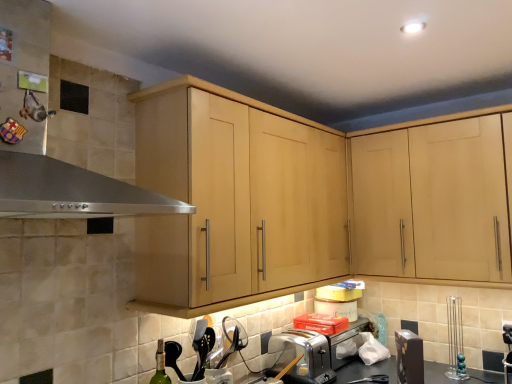
Question: From a real-world perspective, is stainless steel exhaust hood at upper left positioned under green glass bottle at lower left based on gravity?

Choices:
 (A) yes
 (B) no

Answer: (B)

Question: From a real-world perspective, does stainless steel exhaust hood at upper left stand above green glass bottle at lower left?

Choices:
 (A) yes
 (B) no

Answer: (A)

Question: Could you tell me if stainless steel exhaust hood at upper left is facing green glass bottle at lower left?

Choices:
 (A) yes
 (B) no

Answer: (B)

Question: Is stainless steel exhaust hood at upper left at the right side of green glass bottle at lower left?

Choices:
 (A) no
 (B) yes

Answer: (A)

Question: Can you see stainless steel exhaust hood at upper left touching green glass bottle at lower left?

Choices:
 (A) yes
 (B) no

Answer: (B)

Question: From a real-world perspective, relative to green glass bottle at lower left, is light wood cabinet at upper right, which is the 1th cabinetry in right-to-left order, vertically above or below?

Choices:
 (A) above
 (B) below

Answer: (A)

Question: From the image's perspective, is light wood cabinet at upper right, which is the 1th cabinetry in right-to-left order, positioned above or below green glass bottle at lower left?

Choices:
 (A) above
 (B) below

Answer: (A)

Question: Which is correct: light wood cabinet at upper right, which is the 1th cabinetry in right-to-left order, is inside green glass bottle at lower left, or outside of it?

Choices:
 (A) inside
 (B) outside

Answer: (B)

Question: In the image, is light wood cabinet at upper right, acting as the second cabinetry starting from the left, on the left side or the right side of green glass bottle at lower left?

Choices:
 (A) left
 (B) right

Answer: (B)

Question: Considering the positions of point (163, 352) and point (89, 187), is point (163, 352) closer or farther from the camera than point (89, 187)?

Choices:
 (A) closer
 (B) farther

Answer: (B)

Question: From the image's perspective, is green glass bottle at lower left located above or below stainless steel exhaust hood at upper left?

Choices:
 (A) above
 (B) below

Answer: (B)

Question: Is green glass bottle at lower left to the left or to the right of stainless steel exhaust hood at upper left in the image?

Choices:
 (A) right
 (B) left

Answer: (A)

Question: From a real-world perspective, is green glass bottle at lower left above or below stainless steel exhaust hood at upper left?

Choices:
 (A) above
 (B) below

Answer: (B)

Question: From a real-world perspective, is stainless steel exhaust hood at upper left above or below satin silver toaster at lower center?

Choices:
 (A) above
 (B) below

Answer: (A)

Question: Considering the positions of stainless steel exhaust hood at upper left and satin silver toaster at lower center in the image, is stainless steel exhaust hood at upper left wider or thinner than satin silver toaster at lower center?

Choices:
 (A) thin
 (B) wide

Answer: (B)